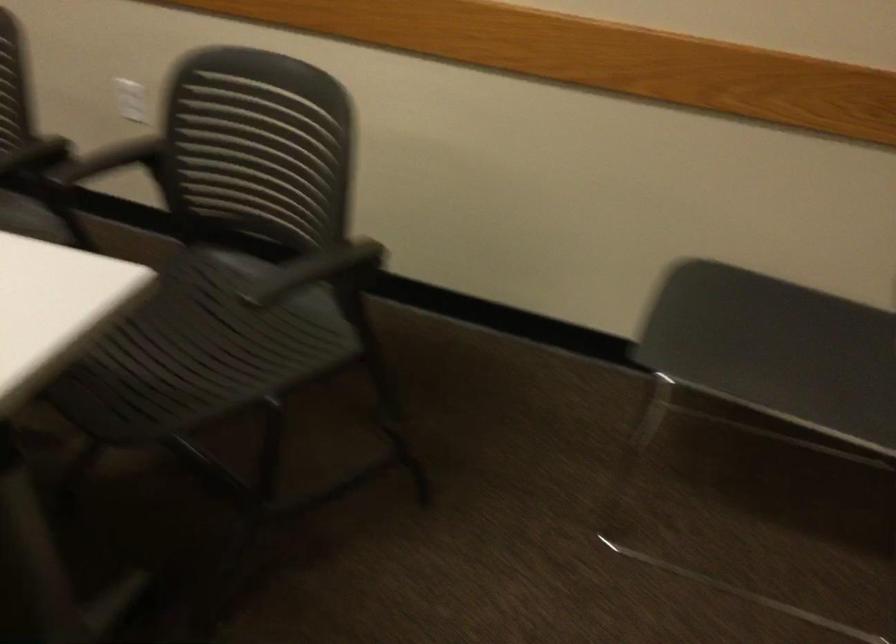
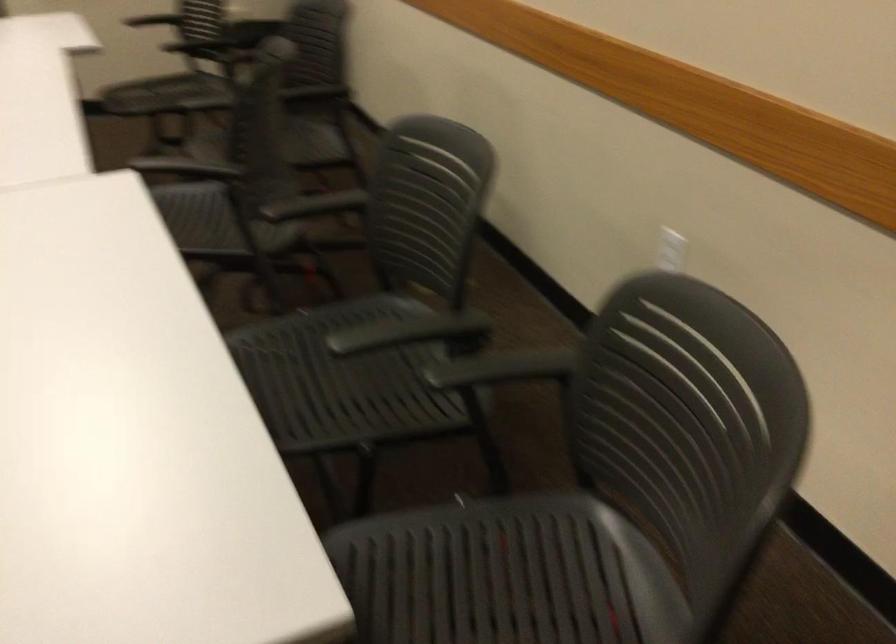
Question: The camera is either moving clockwise (left) or counter-clockwise (right) around the object. The first image is from the beginning of the video and the second image is from the end. Is the camera moving left or right when shooting the video?

Choices:
 (A) Left
 (B) Right

Answer: (B)